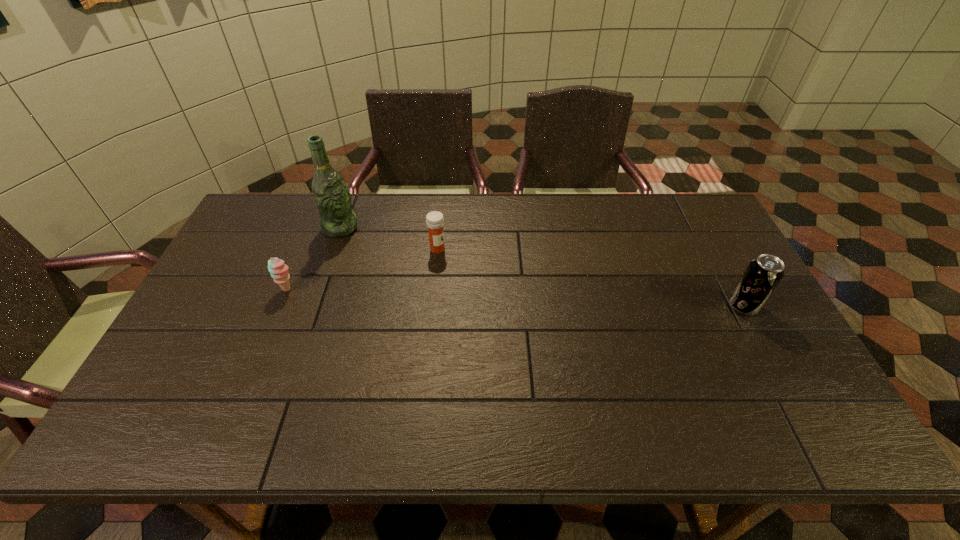
Image resolution: width=960 pixels, height=540 pixels. Find the location of `vacant space on the desktop that is between the leftmost object and the rightmost object and is positioned on the label side of the third object from left to right`. vacant space on the desktop that is between the leftmost object and the rightmost object and is positioned on the label side of the third object from left to right is located at coordinates (532, 298).

The height and width of the screenshot is (540, 960). I want to click on vacant space on the desktop that is between the leftmost object and the soda can and is positioned on the surface of the beer bottle, so click(x=455, y=295).